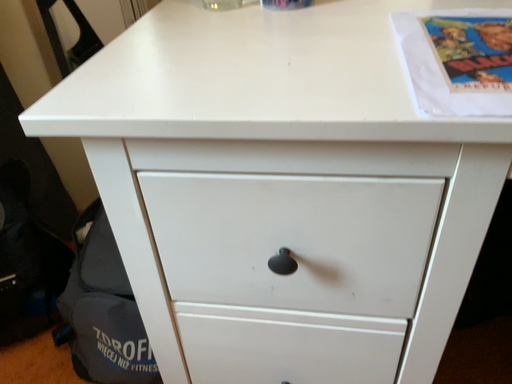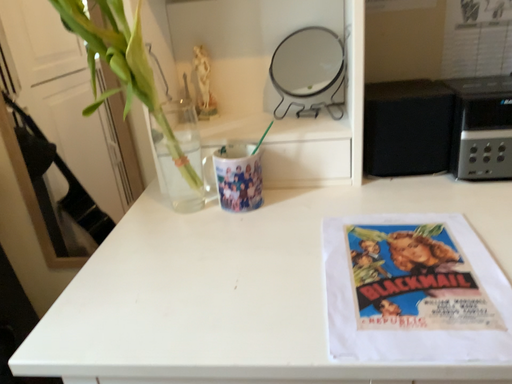
Question: How did the camera likely rotate when shooting the video?

Choices:
 (A) rotated downward
 (B) rotated upward

Answer: (B)